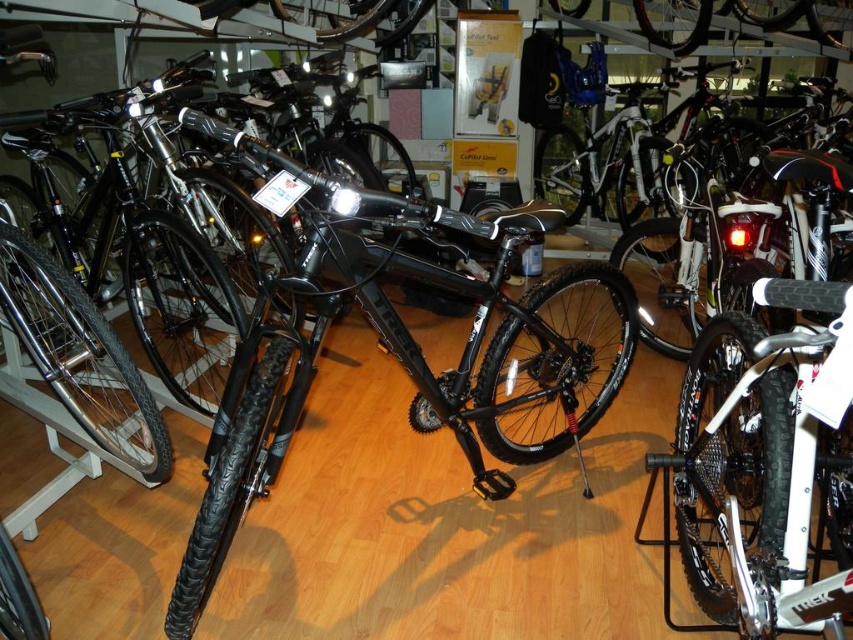
Between point (451, 275) and point (727, 419), which one is positioned in front?

Point (727, 419)

Describe the element at coordinates (408, 353) in the screenshot. This screenshot has height=640, width=853. I see `black matte bicycle at center` at that location.

Between point (225, 140) and point (820, 602), which one is positioned behind?

The point (225, 140) is more distant.

Where is `black matte bicycle at center`? This screenshot has width=853, height=640. black matte bicycle at center is located at coordinates (408, 353).